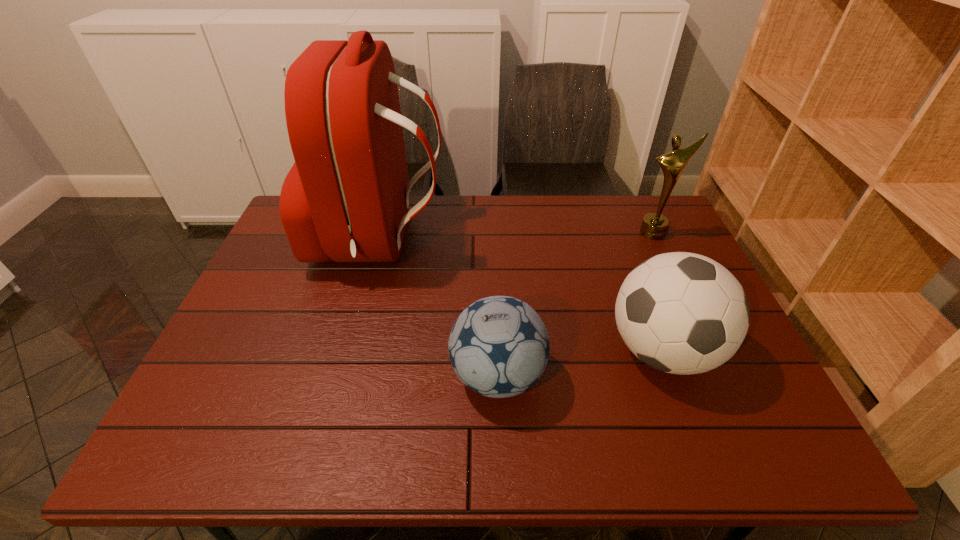
This screenshot has height=540, width=960. I want to click on the tallest object, so click(x=346, y=198).

The height and width of the screenshot is (540, 960). What are the coordinates of `the leftmost object` in the screenshot? It's located at (346, 198).

At what (x,y) coordinates should I click in order to perform the action: click on the third shortest object. Please return your answer as a coordinate pair (x, y). This screenshot has height=540, width=960. Looking at the image, I should click on (654, 226).

Locate an element on the screen. The width and height of the screenshot is (960, 540). the right soccer ball is located at coordinates (683, 313).

I want to click on the second shortest object, so click(x=683, y=313).

The width and height of the screenshot is (960, 540). What are the coordinates of `the left soccer ball` in the screenshot? It's located at (499, 347).

Image resolution: width=960 pixels, height=540 pixels. Identify the location of the shortest object. (499, 347).

Find the location of a particular element. The width and height of the screenshot is (960, 540). blank area located on the strap side of the tallest object is located at coordinates (569, 240).

What are the coordinates of `vacant point located on the front-facing side of the award` in the screenshot? It's located at (676, 280).

Identify the location of free space located 0.120m on the left of the right soccer ball. (557, 350).